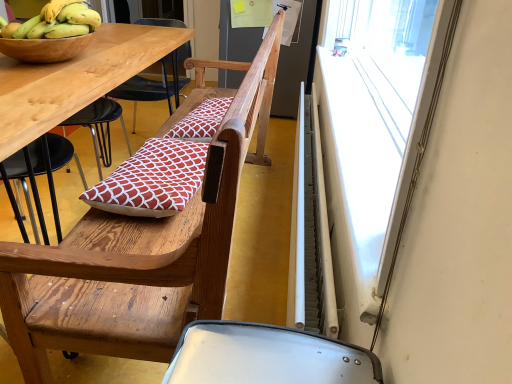
Where is `free area below yellow bananas at upper left (from a real-world perspective)`? This screenshot has width=512, height=384. free area below yellow bananas at upper left (from a real-world perspective) is located at coordinates (62, 33).